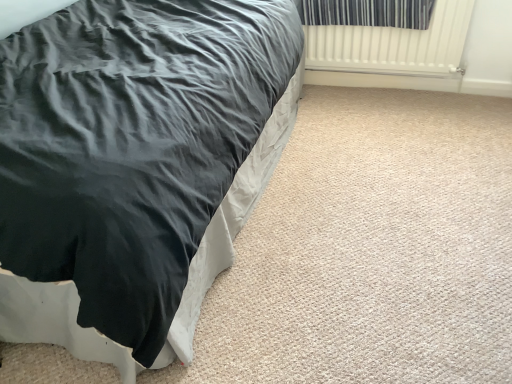
The width and height of the screenshot is (512, 384). What do you see at coordinates (367, 13) in the screenshot?
I see `striped fabric curtain at upper right` at bounding box center [367, 13].

You are a GUI agent. You are given a task and a screenshot of the screen. Output one action in this format:
    pyautogui.click(x=<x>, y=<y>)
    Task: Click on the black satin bed at left
    The width and height of the screenshot is (512, 384).
    Given the screenshot: What is the action you would take?
    pyautogui.click(x=136, y=166)

Measure the distance between point (180, 76) and camera.

Point (180, 76) is 1.30 meters from camera.

This screenshot has height=384, width=512. In order to click on white ribbed radiator at upper right in this screenshot , I will do `click(393, 45)`.

Can you tell me how much striped fabric curtain at upper right and white ribbed radiator at upper right differ in facing direction?

striped fabric curtain at upper right and white ribbed radiator at upper right are facing 0.00181 degrees away from each other.

Does striped fabric curtain at upper right appear on the right side of white ribbed radiator at upper right?

In fact, striped fabric curtain at upper right is to the left of white ribbed radiator at upper right.

Between striped fabric curtain at upper right and white ribbed radiator at upper right, which one has more height?

white ribbed radiator at upper right.

Which is closer, (365, 12) or (431, 26)?

The point (431, 26) is closer.

From the image's perspective, is black satin bed at left located above or below white ribbed radiator at upper right?

Based on their image positions, black satin bed at left is located beneath white ribbed radiator at upper right.

What's the angular difference between black satin bed at left and white ribbed radiator at upper right's facing directions?

The angle between the facing direction of black satin bed at left and the facing direction of white ribbed radiator at upper right is 0.754 degrees.

Can you confirm if black satin bed at left is thinner than white ribbed radiator at upper right?

No, black satin bed at left is not thinner than white ribbed radiator at upper right.

Locate an element on the screen. bed in front of the white ribbed radiator at upper right is located at coordinates (136, 166).

Is point (72, 140) less distant than point (309, 21)?

Yes, it is in front of point (309, 21).

Considering the relative sizes of black satin bed at left and striped fabric curtain at upper right in the image provided, is black satin bed at left wider than striped fabric curtain at upper right?

Correct, the width of black satin bed at left exceeds that of striped fabric curtain at upper right.

From a real-world perspective, between black satin bed at left and striped fabric curtain at upper right, who is vertically lower?

black satin bed at left, from a real-world perspective.

From the image's perspective, between white ribbed radiator at upper right and striped fabric curtain at upper right, who is located below?

white ribbed radiator at upper right is shown below in the image.

Which of these two, white ribbed radiator at upper right or striped fabric curtain at upper right, is thinner?

white ribbed radiator at upper right is thinner.

Which object is closer to the camera taking this photo, white ribbed radiator at upper right or striped fabric curtain at upper right?

Positioned in front is white ribbed radiator at upper right.

Is black satin bed at left completely or partially inside striped fabric curtain at upper right?

That's incorrect, black satin bed at left is not inside striped fabric curtain at upper right.

Would you consider striped fabric curtain at upper right to be distant from black satin bed at left?

Yes, striped fabric curtain at upper right and black satin bed at left are quite far apart.

Is striped fabric curtain at upper right facing towards black satin bed at left?

Yes, striped fabric curtain at upper right faces towards black satin bed at left.

Visually, is striped fabric curtain at upper right positioned to the left or to the right of black satin bed at left?

Based on their positions, striped fabric curtain at upper right is located to the right of black satin bed at left.

Consider the image. From a real-world perspective, between white ribbed radiator at upper right and black satin bed at left, who is vertically higher?

black satin bed at left is physically above.

What's the angular difference between white ribbed radiator at upper right and black satin bed at left's facing directions?

There is a 0.754-degree angle between the facing directions of white ribbed radiator at upper right and black satin bed at left.

Is white ribbed radiator at upper right thinner than black satin bed at left?

Yes, white ribbed radiator at upper right is thinner than black satin bed at left.

Does white ribbed radiator at upper right come in front of black satin bed at left?

No, it is not.

Find the location of `radiator below the striped fabric curtain at upper right (from the image's perspective)`. radiator below the striped fabric curtain at upper right (from the image's perspective) is located at coordinates (393, 45).

The image size is (512, 384). What are the coordinates of `radiator below the black satin bed at left (from a real-world perspective)` in the screenshot? It's located at (393, 45).

Which object lies nearer to the anchor point striped fabric curtain at upper right, black satin bed at left or white ribbed radiator at upper right?

white ribbed radiator at upper right.

Which object lies nearer to the anchor point striped fabric curtain at upper right, white ribbed radiator at upper right or black satin bed at left?

white ribbed radiator at upper right is closer to striped fabric curtain at upper right.

From the image, which object appears to be farther from black satin bed at left, striped fabric curtain at upper right or white ribbed radiator at upper right?

The object further to black satin bed at left is white ribbed radiator at upper right.

Which object lies further to the anchor point white ribbed radiator at upper right, striped fabric curtain at upper right or black satin bed at left?

black satin bed at left is further to white ribbed radiator at upper right.

From the image, which object appears to be nearer to white ribbed radiator at upper right, black satin bed at left or striped fabric curtain at upper right?

striped fabric curtain at upper right lies closer to white ribbed radiator at upper right than the other object.

When comparing their distances from black satin bed at left, does white ribbed radiator at upper right or striped fabric curtain at upper right seem closer?

striped fabric curtain at upper right lies closer to black satin bed at left than the other object.

Find the location of a particular element. This screenshot has width=512, height=384. radiator between black satin bed at left and striped fabric curtain at upper right in the front-back direction is located at coordinates (393, 45).